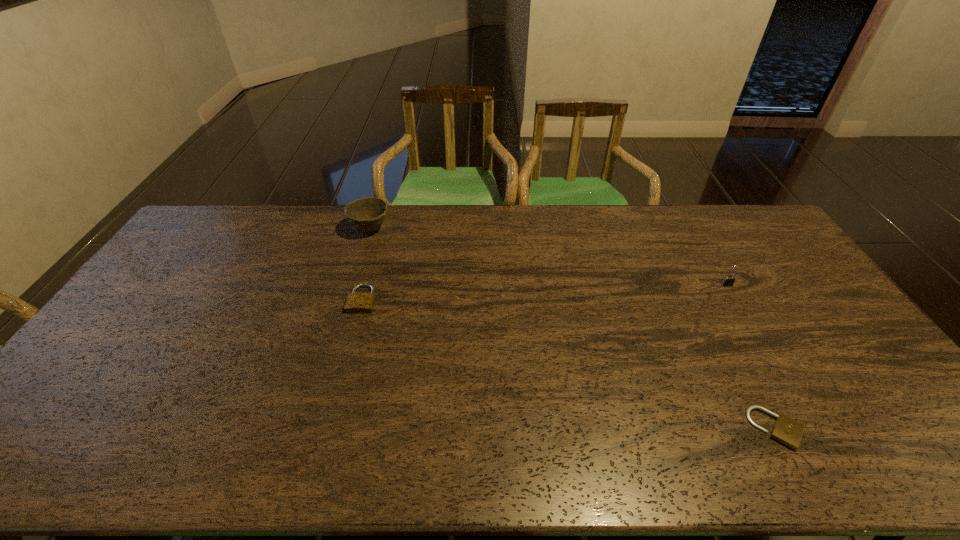
The image size is (960, 540). Identify the location of free space located on the keyhole side of the leftmost padlock. (354, 332).

I want to click on free space located 0.270m on the right of the second padlock from right to left, so click(915, 429).

The height and width of the screenshot is (540, 960). Find the location of `object that is at the far edge`. object that is at the far edge is located at coordinates (367, 214).

Locate an element on the screen. This screenshot has width=960, height=540. object located at the near edge is located at coordinates (787, 431).

The height and width of the screenshot is (540, 960). What are the coordinates of `free space at the far edge` in the screenshot? It's located at (723, 241).

In the image, there is a desktop. Where is `vacant area at the left edge`? The width and height of the screenshot is (960, 540). vacant area at the left edge is located at coordinates (164, 281).

You are a GUI agent. You are given a task and a screenshot of the screen. Output one action in this format:
    pyautogui.click(x=<x>, y=<y>)
    Task: Click on the vacant area at the right edge
    The width and height of the screenshot is (960, 540).
    Given the screenshot: What is the action you would take?
    pyautogui.click(x=814, y=291)

Image resolution: width=960 pixels, height=540 pixels. Find the location of `free spot at the far left corner of the desktop`. free spot at the far left corner of the desktop is located at coordinates (196, 241).

Find the location of a particular element. vacant space at the far right corner of the desktop is located at coordinates (764, 231).

Where is `unoccupied position between the bowl and the tallest padlock`? The height and width of the screenshot is (540, 960). unoccupied position between the bowl and the tallest padlock is located at coordinates (548, 257).